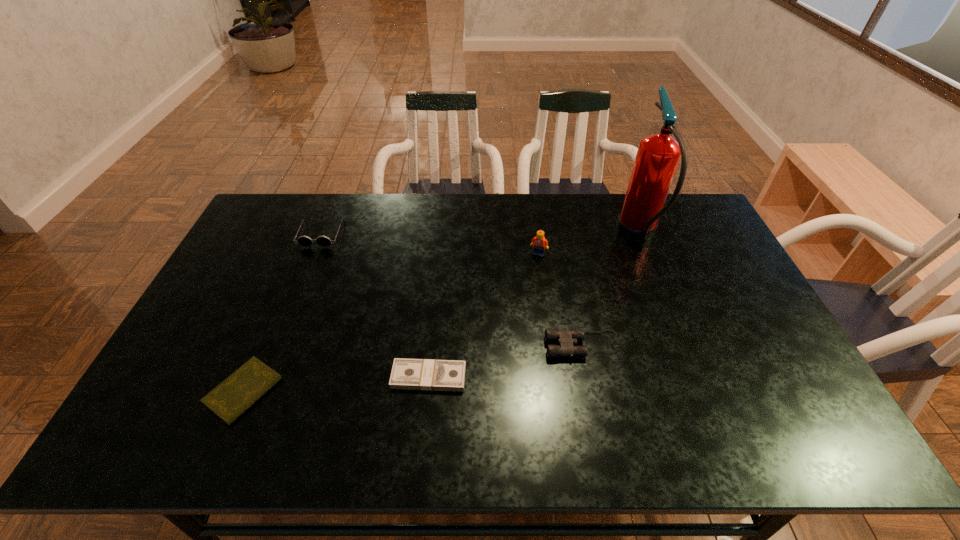
The image size is (960, 540). What are the coordinates of `vacant space located at the eyepiece of the fourth tallest object` in the screenshot? It's located at (x=446, y=346).

Identify the location of vacant space located at the eyepiece of the fourth tallest object. This screenshot has width=960, height=540. (405, 346).

The image size is (960, 540). I want to click on vacant space located 0.360m at the eyepiece of the fourth tallest object, so click(x=413, y=346).

Locate an element on the screen. The height and width of the screenshot is (540, 960). vacant area situated 0.100m on the back of the dollar is located at coordinates (433, 333).

You are a GUI agent. You are given a task and a screenshot of the screen. Output one action in this format:
    pyautogui.click(x=<x>, y=<y>)
    Task: Click on the vacant space located on the back of the diary
    
    Given the screenshot: What is the action you would take?
    pyautogui.click(x=266, y=339)

Where is `fire extinguisher that is positioned at the far edge`? fire extinguisher that is positioned at the far edge is located at coordinates (658, 155).

At what (x,y) coordinates should I click in order to perform the action: click on sunglasses positioned at the far edge. Please return your answer as a coordinate pair (x, y). Looking at the image, I should click on (305, 241).

The width and height of the screenshot is (960, 540). Identify the location of object at the near edge. (232, 397).

You are a GUI agent. You are given a task and a screenshot of the screen. Output one action in this format:
    pyautogui.click(x=<x>, y=<y>)
    Task: Click on the object present at the left edge
    
    Given the screenshot: What is the action you would take?
    pyautogui.click(x=232, y=397)

Locate an element on the screen. object located in the near left corner section of the desktop is located at coordinates (232, 397).